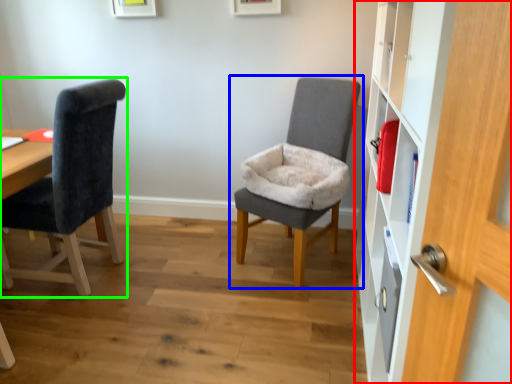
Question: Which object is positioned farthest from dresser (highlighted by a red box)? Select from chair (highlighted by a blue box) and chair (highlighted by a green box).

Choices:
 (A) chair
 (B) chair

Answer: (B)